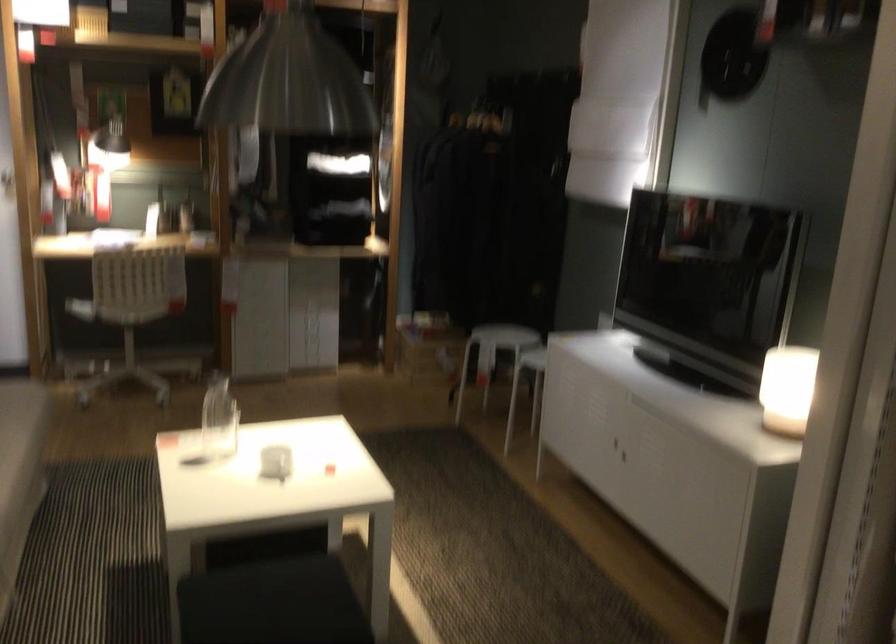
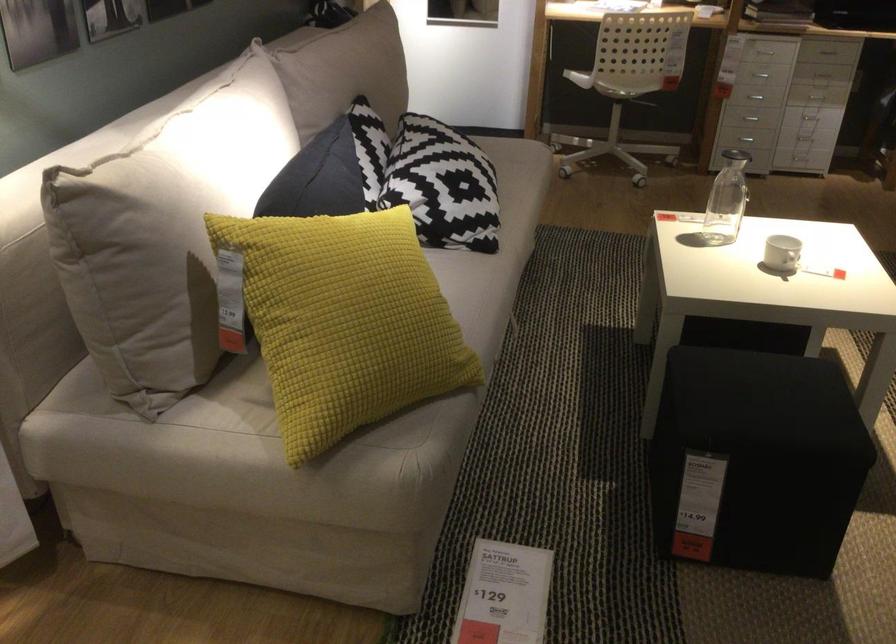
Find the pixel in the second image that matches the point at 300,339 in the first image.

(810, 118)